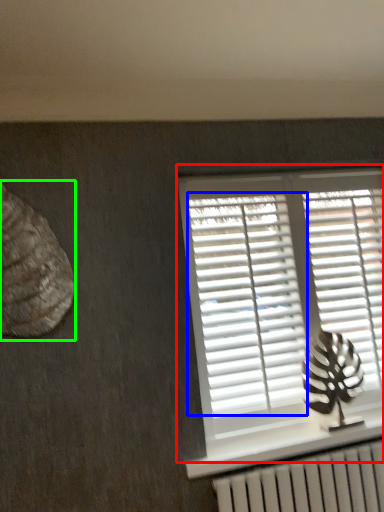
Question: Which object is the farthest from window (highlighted by a red box)? Choose among these: shutter (highlighted by a blue box) or animal (highlighted by a green box).

Choices:
 (A) shutter
 (B) animal

Answer: (B)